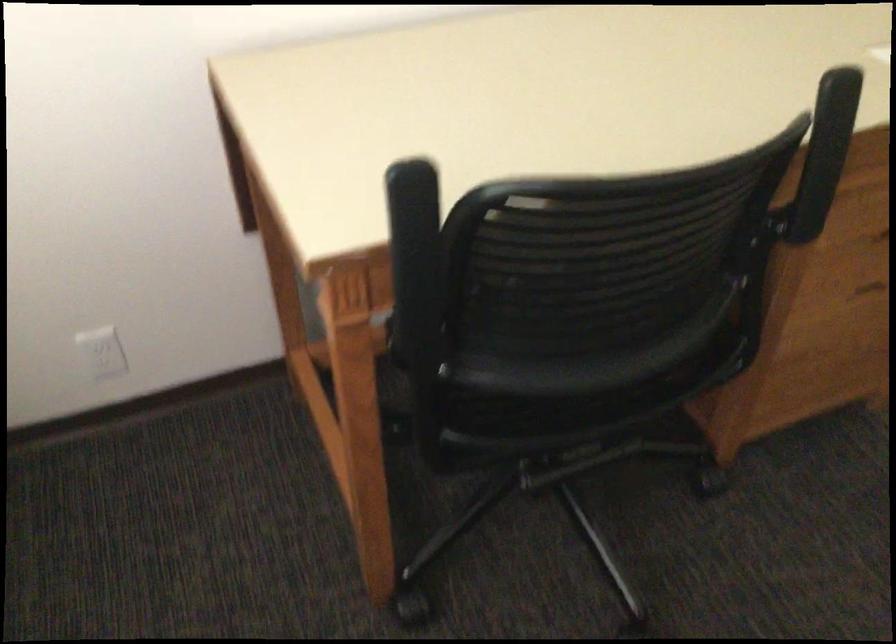
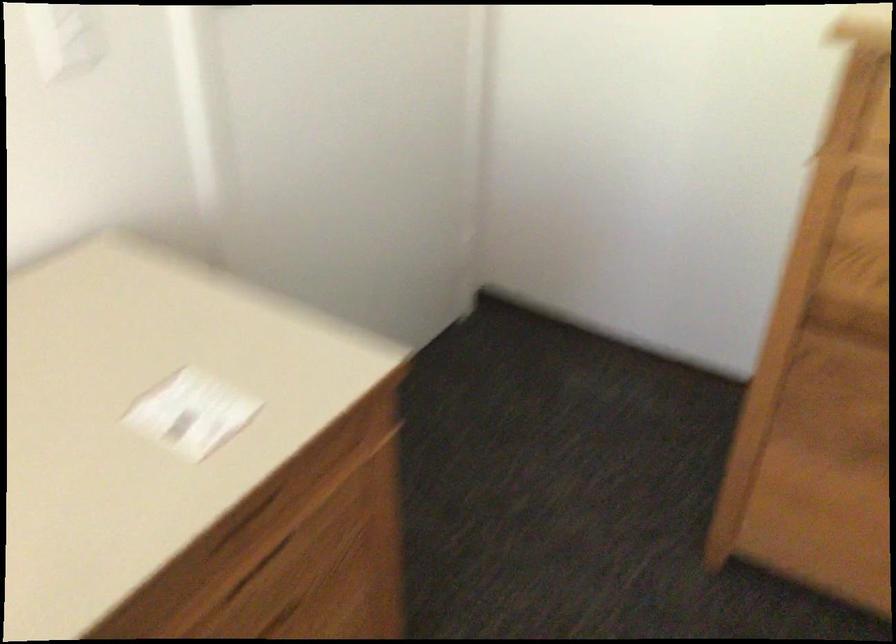
Question: The images are taken continuously from a first-person perspective. In which direction is your viewpoint rotating?

Choices:
 (A) Left
 (B) Right
 (C) Up
 (D) Down

Answer: (B)